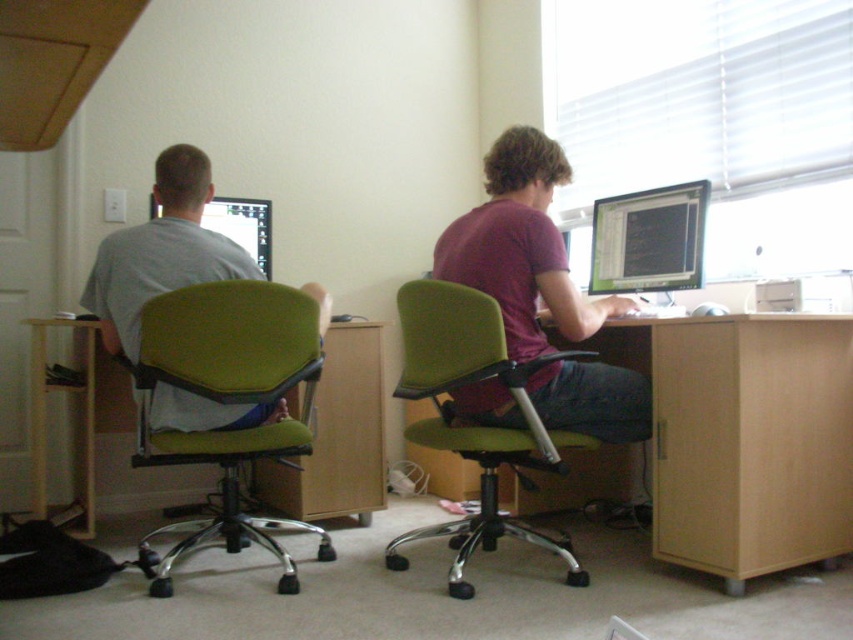
You are standing in the shared workspace and want to place a small potted plant between the two points labeled point [193,193] and point [604,216]. Which point should the plant be closer to in order to be nearer to the viewer?

The plant should be placed closer to point [193,193] because it is closer to the viewer than point [604,216].